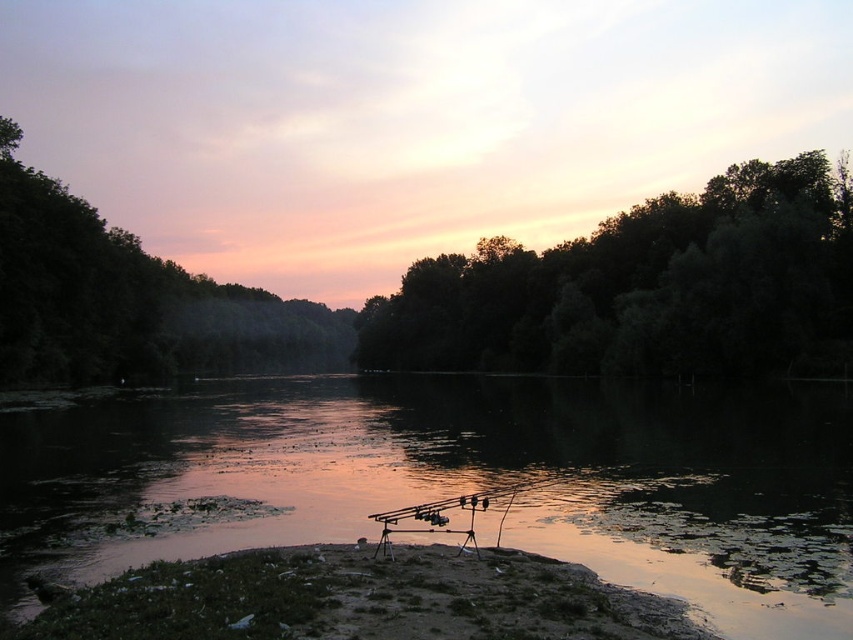
You are standing at the riverside and want to take a photo of the dark green leafy trees at upper center. If your camera can focus on objects up to 60 meters away, will you be able to capture a clear image of them?

The dark green leafy trees at upper center are 62.33 meters away from the camera. Since the camera can only focus up to 60 meters, you will not be able to capture a clear image of them.

You are planning to set up a small tent for a quick rest. The translucent water at center and the brown dirt at lower center are the only flat areas available. Which area is more suitable for setting up your tent based on their sizes?

The translucent water at center is bigger than brown dirt at lower center, so it provides a larger flat area. However, since water is not a solid surface, the brown dirt at lower center is the only suitable option for setting up the tent despite its smaller size.